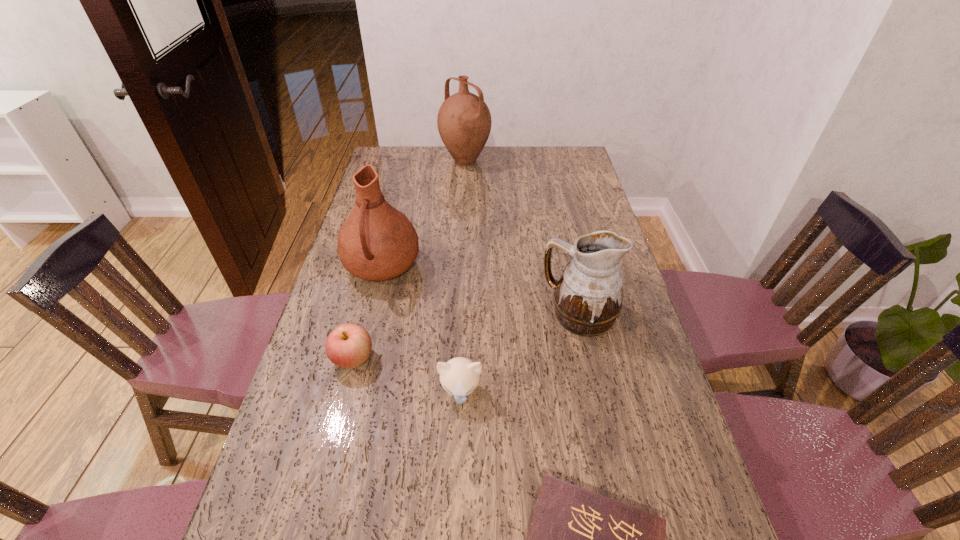
The width and height of the screenshot is (960, 540). I want to click on the farthest pitcher, so click(x=464, y=122).

Locate an element on the screen. the second pitcher from left to right is located at coordinates (464, 122).

Where is `the leftmost pitcher`? This screenshot has width=960, height=540. the leftmost pitcher is located at coordinates (376, 242).

The image size is (960, 540). In order to click on the rightmost pitcher in this screenshot , I will do `click(588, 297)`.

Find the location of a particular element. The height and width of the screenshot is (540, 960). kitten is located at coordinates (460, 376).

Where is `apple`? The height and width of the screenshot is (540, 960). apple is located at coordinates (349, 345).

What are the coordinates of `vacant region located on the front of the farthest object` in the screenshot? It's located at (462, 226).

You are a GUI agent. You are given a task and a screenshot of the screen. Output one action in this format:
    pyautogui.click(x=<x>, y=<y>)
    Task: Click on the vacant point located on the side of the leftmost pitcher with the handle
    The width and height of the screenshot is (960, 540).
    Given the screenshot: What is the action you would take?
    [354, 384]

I want to click on vacant space situated 0.100m from the spout of the rightmost pitcher, so click(x=507, y=314).

Locate an element on the screen. vacant area situated 0.100m from the spout of the rightmost pitcher is located at coordinates (507, 314).